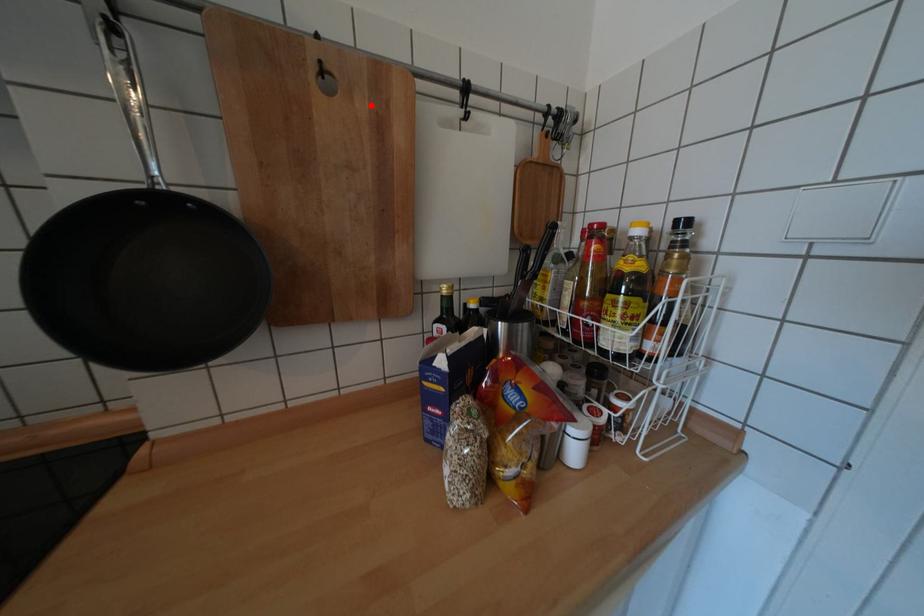
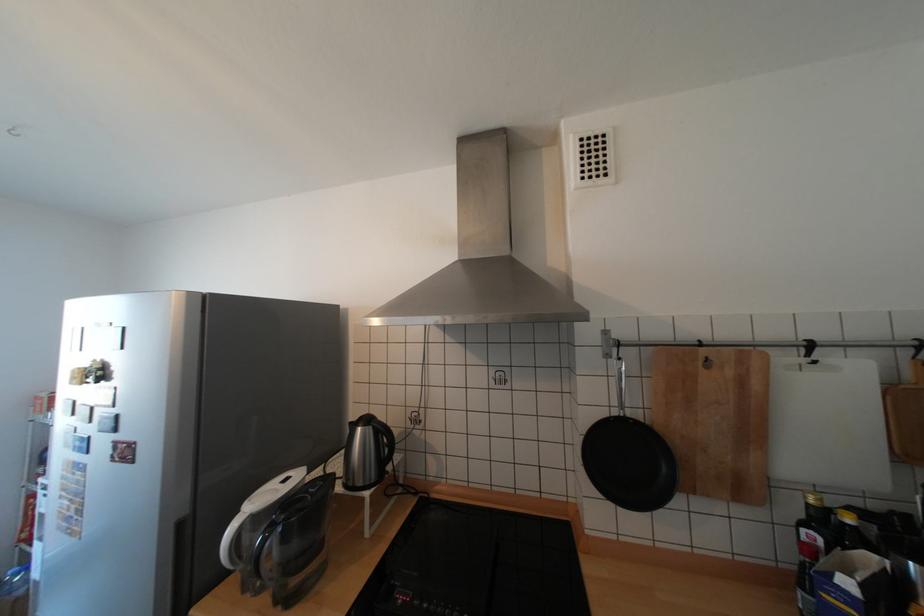
Locate, in the second image, the point that corresponds to the highlighted location in the first image.

(738, 371)